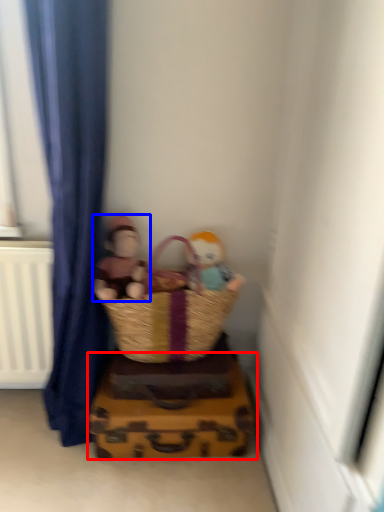
Question: Among these objects, which one is nearest to the camera, crate (highlighted by a red box) or person (highlighted by a blue box)?

Choices:
 (A) crate
 (B) person

Answer: (B)